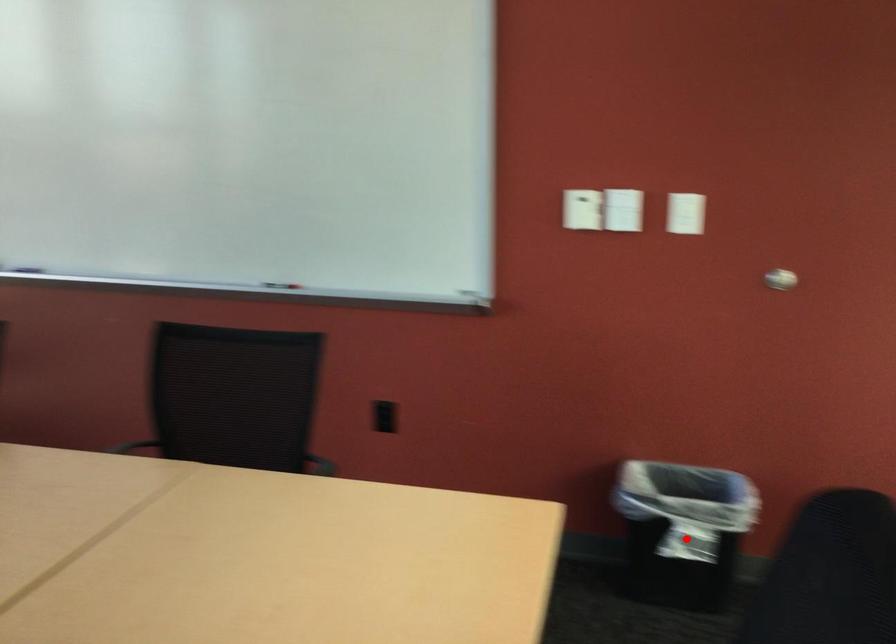
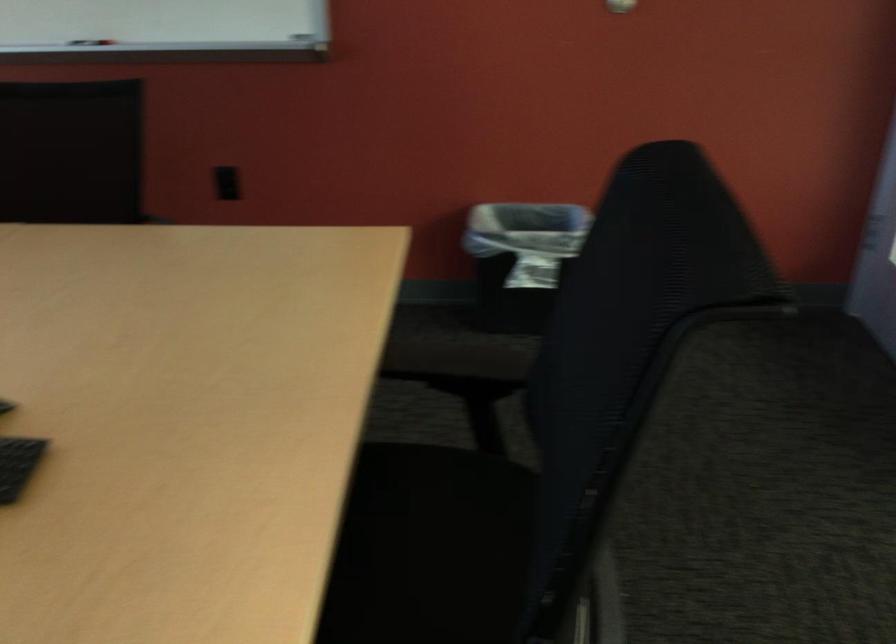
Locate, in the second image, the point that corresponds to the highlighted location in the first image.

(521, 260)